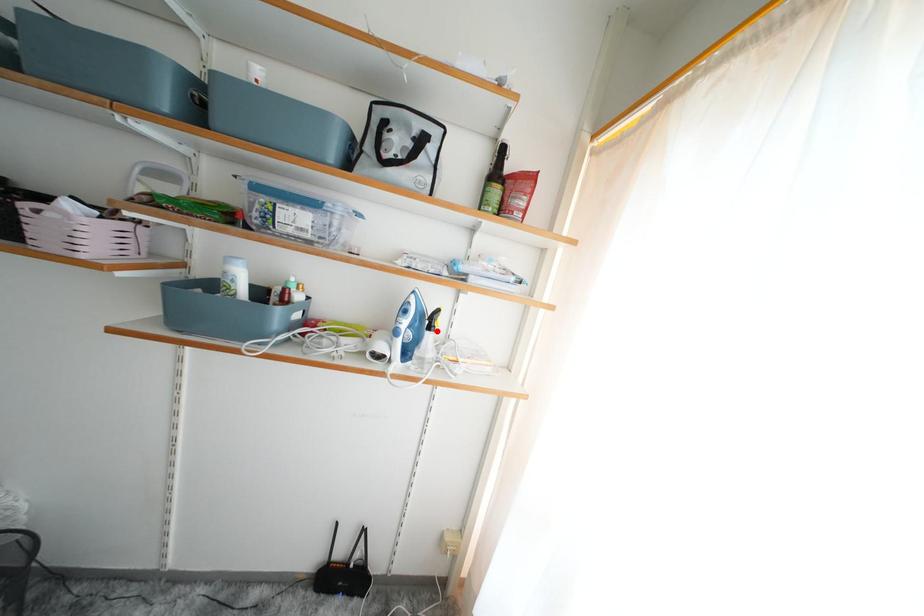
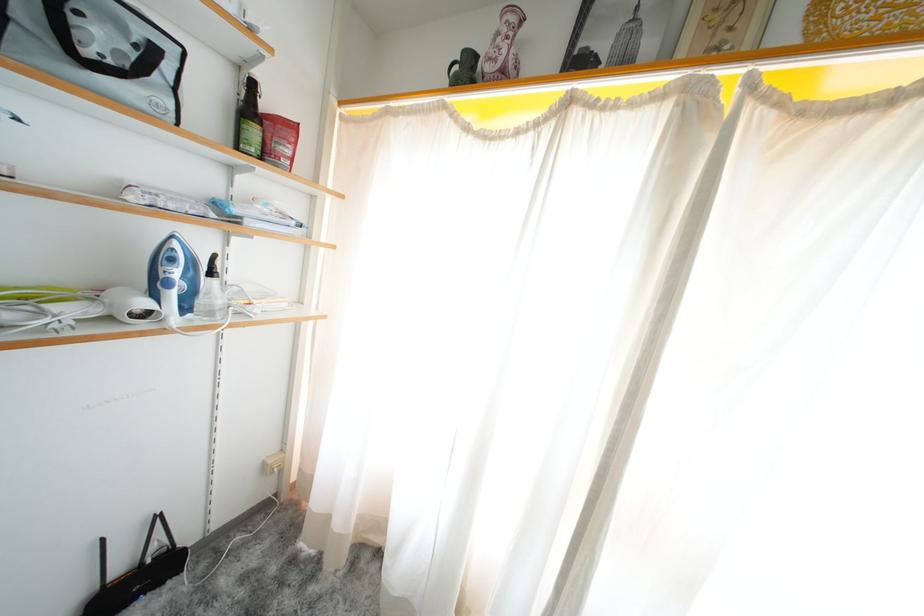
Locate, in the second image, the point that corresponds to the highlighted location in the first image.

(217, 278)